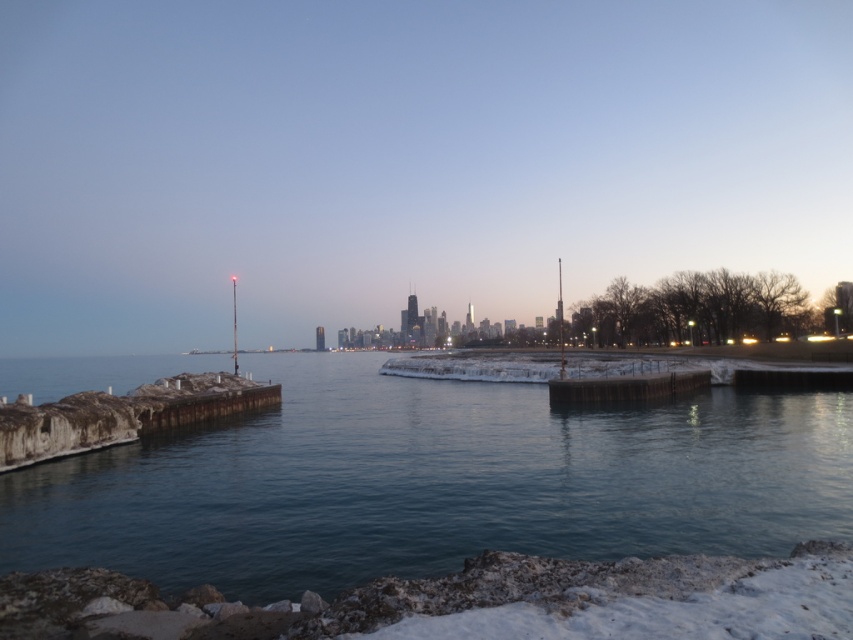
Does rusty wood dock at lower left have a larger size compared to wooden dock at center?

Yes, rusty wood dock at lower left is bigger than wooden dock at center.

How far apart are rusty wood dock at lower left and wooden dock at center?

rusty wood dock at lower left and wooden dock at center are 19.81 meters apart from each other.

Identify the location of rusty wood dock at lower left. This screenshot has height=640, width=853. (122, 413).

Who is positioned more to the left, smooth concrete piers at lower left or rusty wood dock at lower left?

smooth concrete piers at lower left is more to the left.

Does smooth concrete piers at lower left appear over rusty wood dock at lower left?

Incorrect, smooth concrete piers at lower left is not positioned above rusty wood dock at lower left.

Image resolution: width=853 pixels, height=640 pixels. What are the coordinates of `smooth concrete piers at lower left` in the screenshot? It's located at (433, 483).

Can you confirm if smooth concrete piers at lower left is positioned to the left of wooden dock at center?

Yes, smooth concrete piers at lower left is to the left of wooden dock at center.

Which is below, smooth concrete piers at lower left or wooden dock at center?

smooth concrete piers at lower left

Is point (685, 548) farther from viewer compared to point (561, 388)?

No, (685, 548) is closer to viewer.

Identify the location of smooth concrete piers at lower left. Image resolution: width=853 pixels, height=640 pixels. (433, 483).